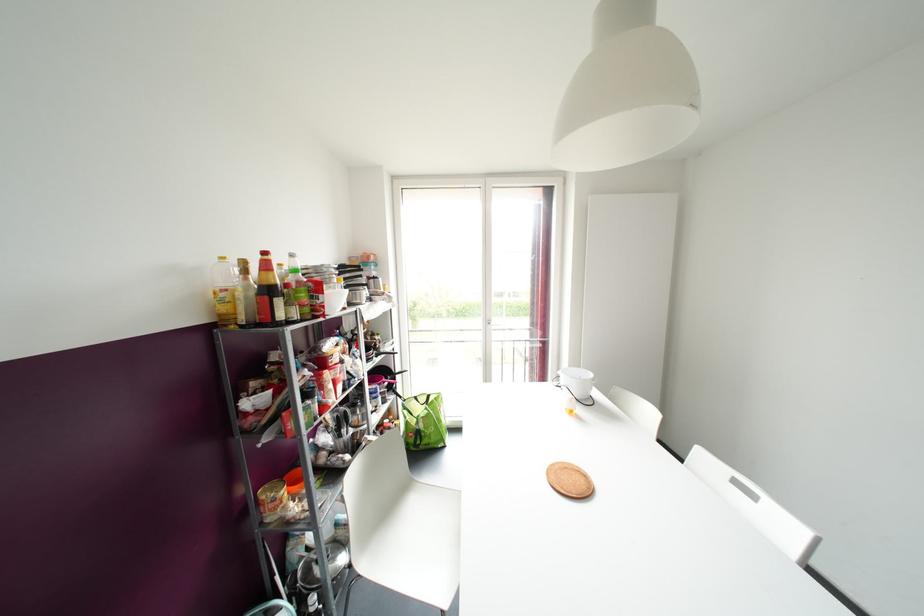
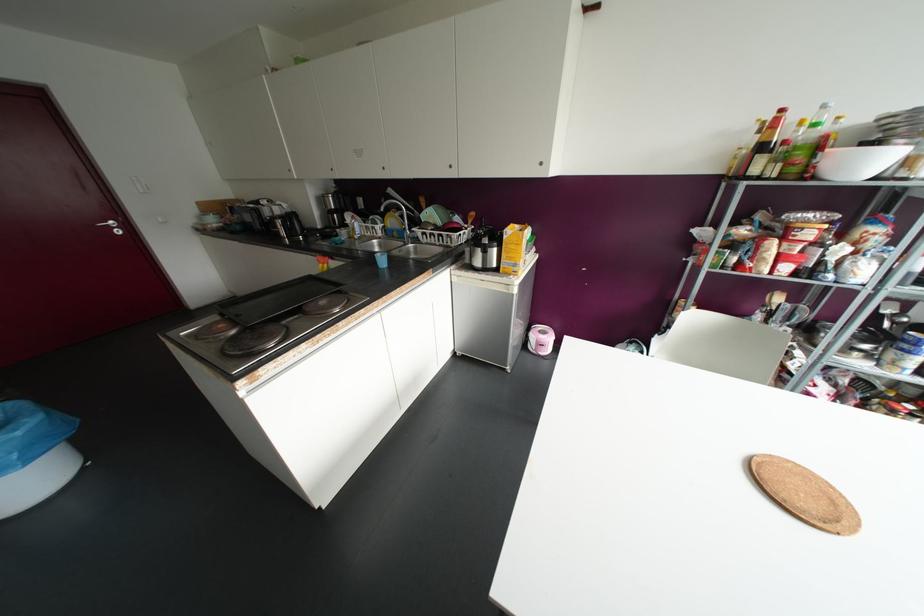
The point at (264, 253) is marked in the first image. Where is the corresponding point in the second image?

(781, 110)